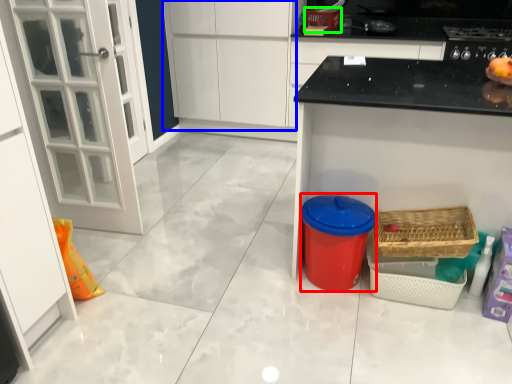
Question: Which object is the farthest from appliance (highlighted by a red box)? Choose among these: cabinetry (highlighted by a blue box) or basket (highlighted by a green box).

Choices:
 (A) cabinetry
 (B) basket

Answer: (B)